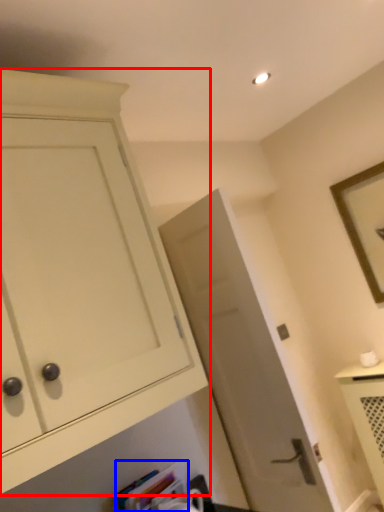
Question: Which point is further to the camera, cabinetry (highlighted by a red box) or book (highlighted by a blue box)?

Choices:
 (A) cabinetry
 (B) book

Answer: (B)